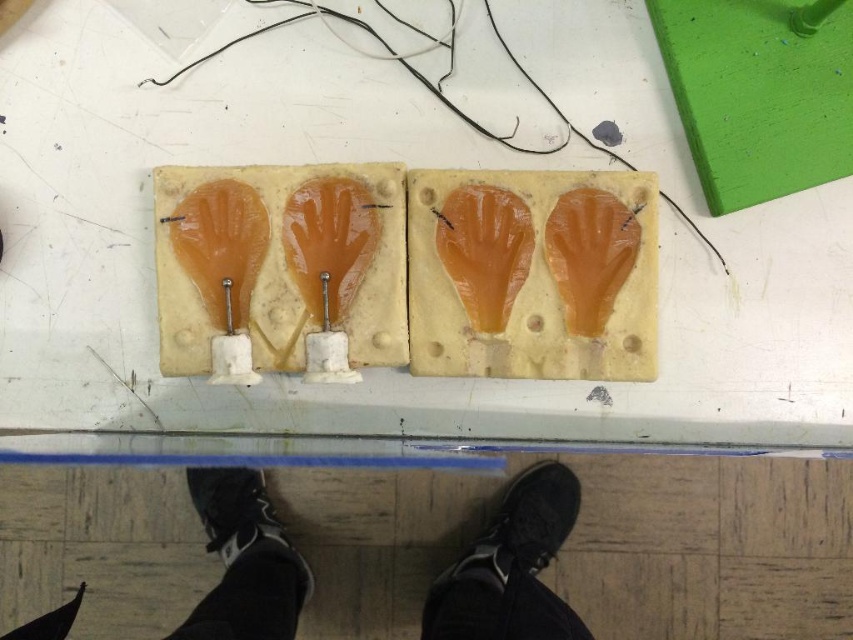
Question: Which object appears farthest from the camera in this image?

Choices:
 (A) black synthetic shoe at lower center
 (B) black fabric pants at lower center
 (C) black rubber shoe at lower center

Answer: (C)

Question: Among these points, which one is nearest to the camera?

Choices:
 (A) (556, 605)
 (B) (231, 522)

Answer: (A)

Question: Which point is closer to the camera?

Choices:
 (A) black fabric pants at lower center
 (B) black rubber shoe at lower center

Answer: (A)

Question: Does black synthetic shoe at lower center have a smaller size compared to black rubber shoe at lower center?

Choices:
 (A) yes
 (B) no

Answer: (B)

Question: Does black fabric pants at lower center have a lesser width compared to black rubber shoe at lower center?

Choices:
 (A) no
 (B) yes

Answer: (A)

Question: Can you confirm if black fabric pants at lower center is smaller than black synthetic shoe at lower center?

Choices:
 (A) no
 (B) yes

Answer: (A)